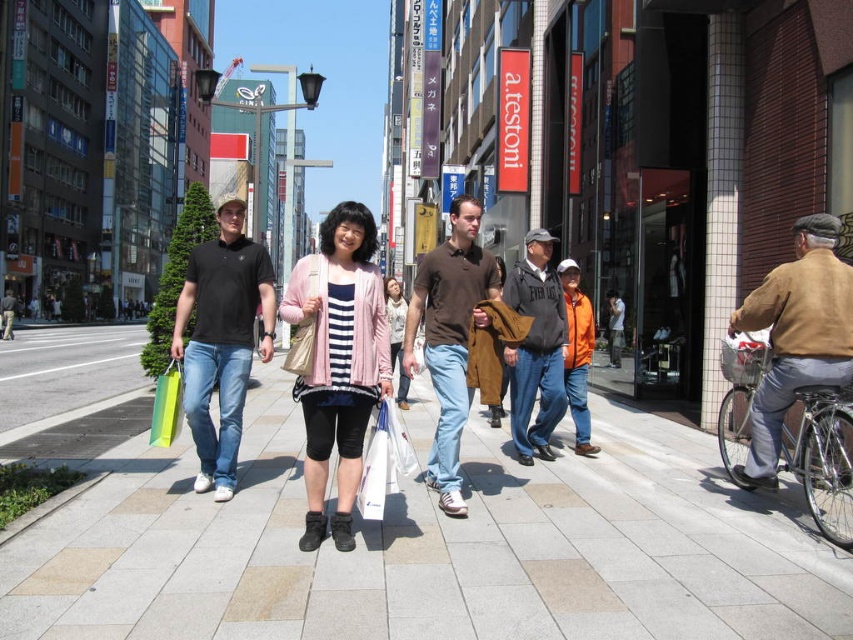
You are a photographer trying to capture both the pink fabric jacket at center and the brown leather jacket at center in a single frame. Based on their sizes, which jacket might require you to adjust your camera angle to ensure it fits entirely in the shot?

The pink fabric jacket at center might be wider than the brown leather jacket at center, so the photographer might need to adjust the camera angle to accommodate its width to ensure it fits entirely in the shot.

You are a photographer standing on the sidewalk capturing the scene. You notice the green matte shopping bag at lower left and the matte pink sweater at center. Which object is shorter in height?

The green matte shopping bag at lower left is shorter in height than the matte pink sweater at center.

You are a delivery person carrying a box that is 2 meters long. You need to move it from the light gray stone pavement at center to the brown leather jacket at right. Is the space between them wide enough to carry the box without tilting it sideways?

The distance between the light gray stone pavement at center and brown leather jacket at right is 2.21 meters. Since the box is 2 meters long, there is enough space to carry it without tilting sideways.